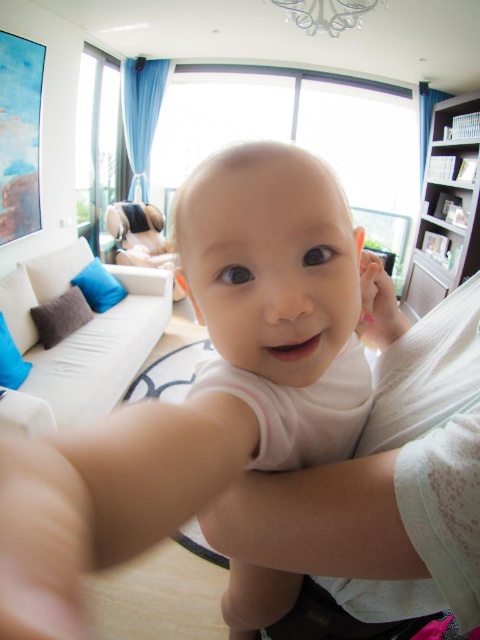
From the picture: You are standing in the living room and want to place a small gift for the baby. The gift needs to be placed exactly at the point where the white soft baby at center is currently located, which is at point (x=111, y=499). Since the baby is being held, where should you place the gift so that it is at the correct coordinates?

The white soft baby at center is located at point (x=111, y=499), so you should place the gift at that exact coordinate to ensure it is in the correct position.

You are a photographer standing 6 feet away from the white soft baby at center. You want to take a closeup photo of the baby without moving the baby. Can you move closer to the baby to achieve this?

The distance between you and the white soft baby at center is currently 6 feet, but the camera is only 4.33 inches away. This suggests the camera is already very close to the baby, so moving closer might not be necessary. However, since you are 6 feet away, you can move slightly closer to reduce the distance for a better closeup.

You are a photographer setting up for a baby photo shoot in the living room. The baby is currently at the center wearing a light colored sleeveless top. The photographer wants to position the baby so that it is closer to the camera than the white sofa with blue and brown cushions on the left. Is the current position of the white soft baby at center suitable for this requirement?

The white soft baby at center is located at point (111, 499). Since the coordinates indicate its position relative to the camera, the baby is already positioned closer to the camera than the white sofa on the left. Therefore, the current position is suitable.